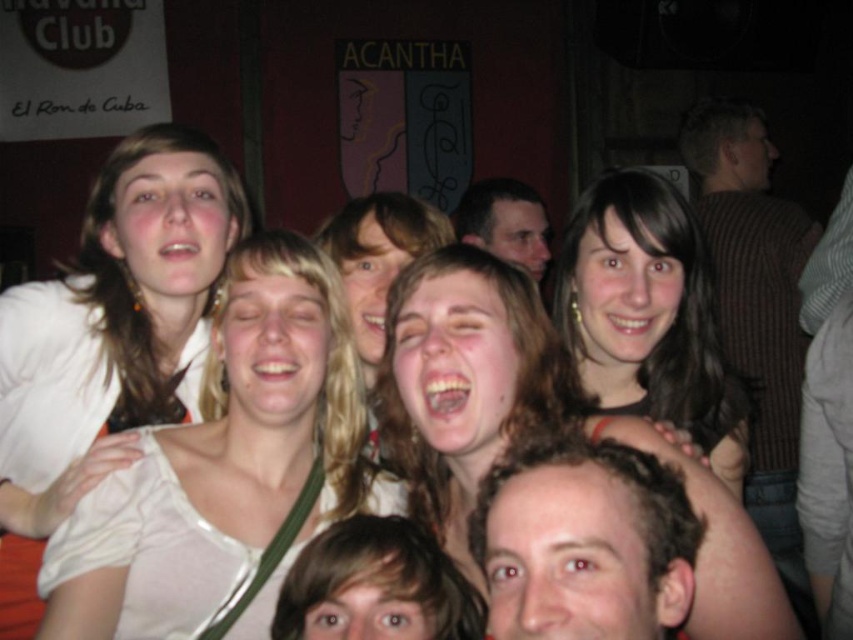
Question: Estimate the real-world distances between objects in this image. Which object is closer to the matte black hair at upper center?

Choices:
 (A) white satin blouse at center
 (B) matte white blouse at upper left
 (C) knitted sweater at right
 (D) smooth skin face at center

Answer: (C)

Question: Estimate the real-world distances between objects in this image. Which object is closer to the smooth skin face at center?

Choices:
 (A) smooth brown hair at center
 (B) matte white blouse at upper left

Answer: (A)

Question: Is white satin blouse at center to the left of smooth brown hair at center from the viewer's perspective?

Choices:
 (A) yes
 (B) no

Answer: (A)

Question: Can you confirm if knitted sweater at right is wider than matte black hair at upper center?

Choices:
 (A) no
 (B) yes

Answer: (B)

Question: Which object is positioned farthest from the matte black hair at upper center?

Choices:
 (A) white satin blouse at center
 (B) smooth skin face at center

Answer: (B)

Question: Is white satin blouse at center wider than smooth brown hair at center?

Choices:
 (A) no
 (B) yes

Answer: (B)